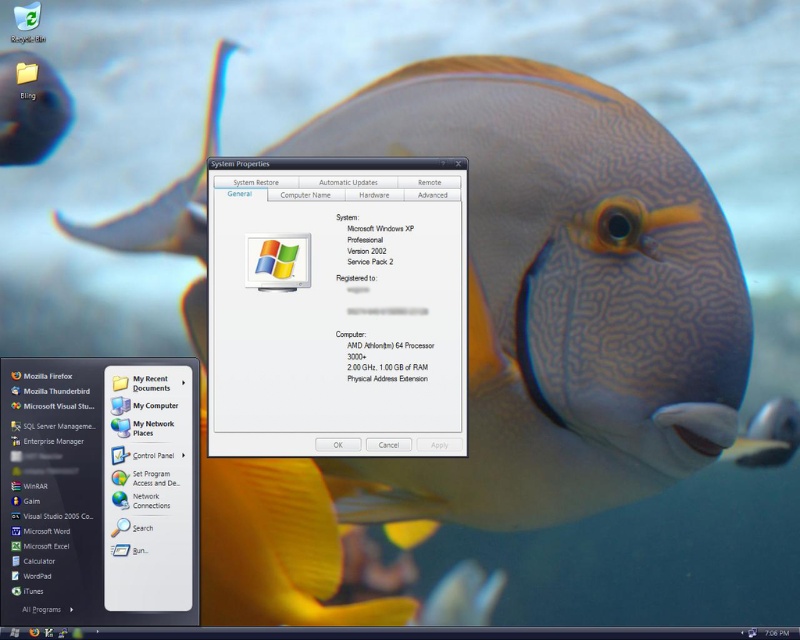
Question: Can you confirm if smooth gray fish at center is smaller than transparent plastic window at center?

Choices:
 (A) yes
 (B) no

Answer: (B)

Question: Does translucent glass fish at upper left have a larger size compared to shiny blue fish at upper left?

Choices:
 (A) yes
 (B) no

Answer: (A)

Question: Among these objects, which one is farthest from the camera?

Choices:
 (A) shiny blue fish at upper left
 (B) transparent plastic window at center

Answer: (B)

Question: Observing the image, what is the correct spatial positioning of transparent plastic window at center in reference to shiny blue fish at upper left?

Choices:
 (A) right
 (B) left

Answer: (A)

Question: Which of the following is the closest to the observer?

Choices:
 (A) shiny blue fish at upper left
 (B) smooth gray fish at center
 (C) translucent glass fish at upper left

Answer: (B)

Question: Estimate the real-world distances between objects in this image. Which object is farther from the smooth gray fish at center?

Choices:
 (A) shiny blue fish at upper left
 (B) translucent glass fish at upper left
 (C) transparent plastic window at center

Answer: (A)